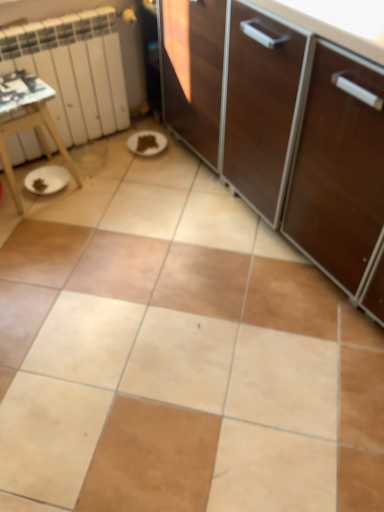
Where is `free location to the right of white wooden table at left`? The image size is (384, 512). free location to the right of white wooden table at left is located at coordinates (102, 185).